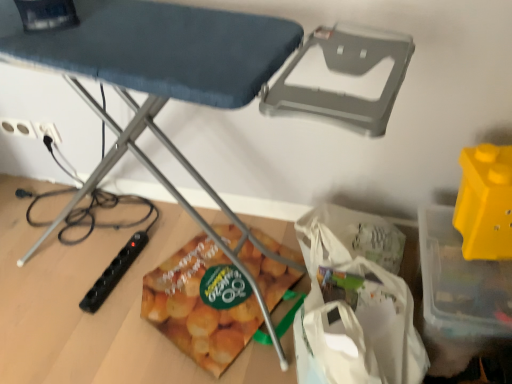
Where is `free space behind black plastic power strip at lower left, marked as the 1th toy in a bottom-to-top arrangement`? free space behind black plastic power strip at lower left, marked as the 1th toy in a bottom-to-top arrangement is located at coordinates (124, 230).